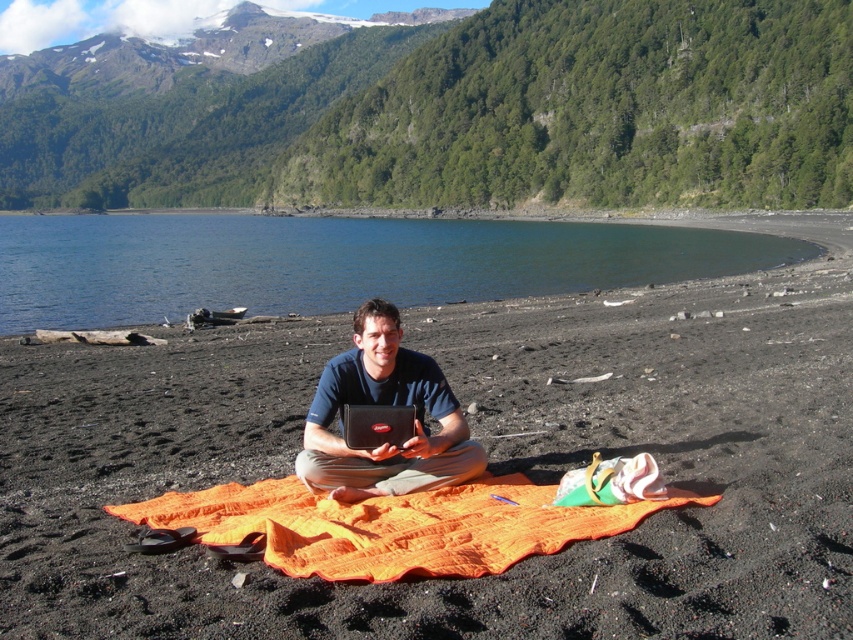
Question: Can you confirm if blue water at center is positioned to the left of dark blue fabric at center?

Choices:
 (A) yes
 (B) no

Answer: (A)

Question: Among these points, which one is farthest from the camera?

Choices:
 (A) (639, 504)
 (B) (761, 253)
 (C) (367, 364)

Answer: (B)

Question: Which point is farther to the camera?

Choices:
 (A) (120, 515)
 (B) (752, 493)
 (C) (694, 272)
 (D) (344, 380)

Answer: (C)

Question: In this image, where is blue water at center located relative to dark blue fabric at center?

Choices:
 (A) below
 (B) above

Answer: (B)

Question: Which of the following is the closest to the observer?

Choices:
 (A) blue water at center
 (B) orange woven blanket at center
 (C) orange fabric at center

Answer: (C)

Question: Does orange fabric at center appear over orange woven blanket at center?

Choices:
 (A) yes
 (B) no

Answer: (A)